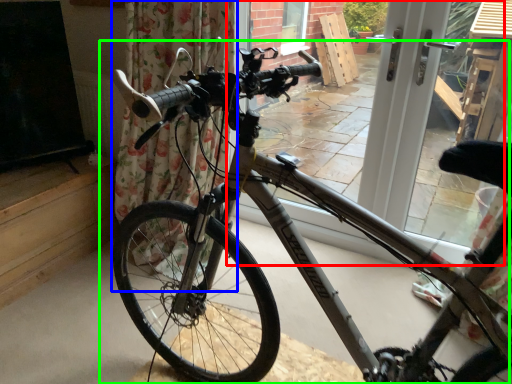
Question: Which object is positioned closest to window frame (highlighted by a red box)? Select from curtain (highlighted by a blue box) and bicycle (highlighted by a green box).

Choices:
 (A) curtain
 (B) bicycle

Answer: (B)